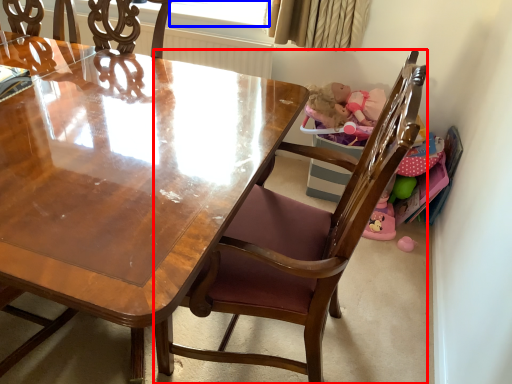
Question: Which of the following is the closest to the observer, chair (highlighted by a red box) or window screen (highlighted by a blue box)?

Choices:
 (A) chair
 (B) window screen

Answer: (A)